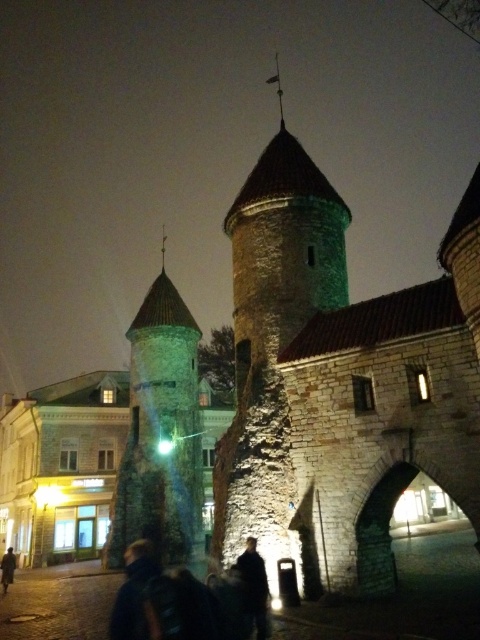
Question: Does dark blue jacket at lower left have a smaller size compared to dark fabric jacket at center?

Choices:
 (A) no
 (B) yes

Answer: (A)

Question: Can you confirm if dark fabric jacket at center is smaller than brown leather jacket at lower left?

Choices:
 (A) no
 (B) yes

Answer: (B)

Question: Which is farther from the brown leather jacket at lower left?

Choices:
 (A) dark fabric jacket at center
 (B) stone tower at center

Answer: (B)

Question: Which object is closer to the camera taking this photo?

Choices:
 (A) dark stone tower at center
 (B) brown leather jacket at lower left

Answer: (B)

Question: From the image, what is the correct spatial relationship of dark blue jacket at lower left in relation to dark fabric jacket at center?

Choices:
 (A) left
 (B) right

Answer: (A)

Question: Which is farther from the dark blue jacket at lower left?

Choices:
 (A) stone tower at center
 (B) brown leather jacket at lower left

Answer: (A)